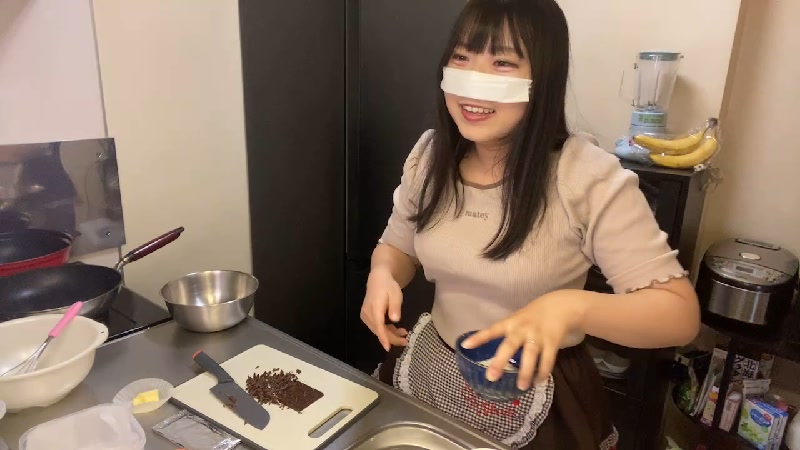
Find the location of a particular element. The height and width of the screenshot is (450, 800). knife handle is located at coordinates (210, 366).